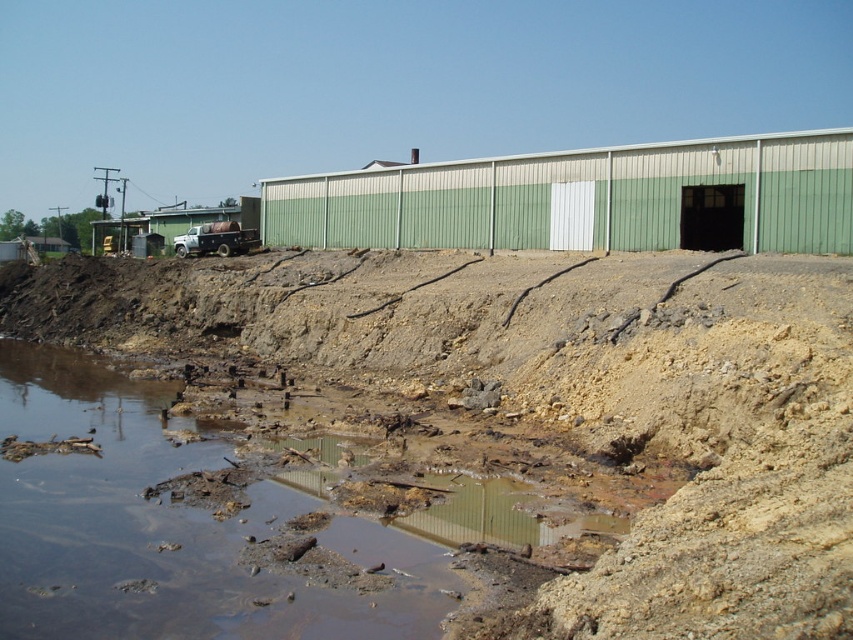
Question: Can you confirm if dull brown dirt at lower left is bigger than muddy water at lower left?

Choices:
 (A) no
 (B) yes

Answer: (B)

Question: Which of the following is the farthest from the observer?

Choices:
 (A) dull brown dirt at lower left
 (B) muddy water at lower left

Answer: (B)

Question: Which point appears farthest from the camera in this image?

Choices:
 (A) (627, 561)
 (B) (364, 557)

Answer: (B)

Question: Is dull brown dirt at lower left positioned behind muddy water at lower left?

Choices:
 (A) yes
 (B) no

Answer: (B)

Question: Is dull brown dirt at lower left bigger than muddy water at lower left?

Choices:
 (A) yes
 (B) no

Answer: (A)